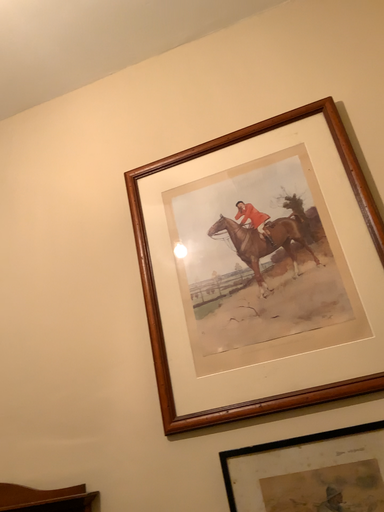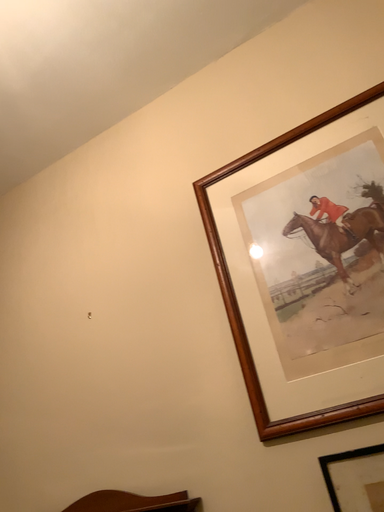
Question: Which way did the camera rotate in the video?

Choices:
 (A) rotated left
 (B) rotated right

Answer: (A)